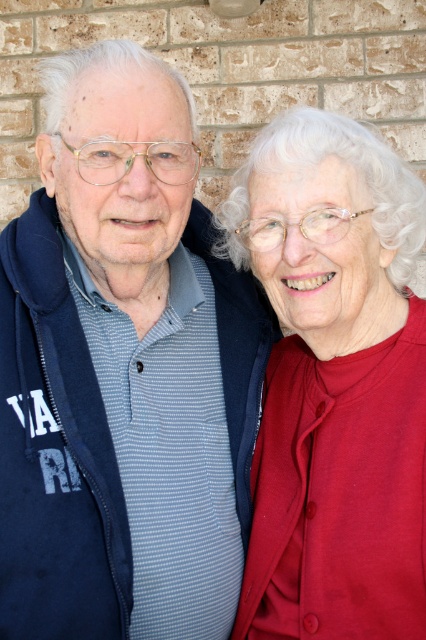
Question: Which point is farther to the camera?

Choices:
 (A) (106, 300)
 (B) (316, 481)

Answer: (A)

Question: Does blue striped shirt at center appear over matte red sweater at right?

Choices:
 (A) yes
 (B) no

Answer: (A)

Question: Can you confirm if blue striped shirt at center is positioned to the left of matte red sweater at right?

Choices:
 (A) no
 (B) yes

Answer: (B)

Question: Is blue striped shirt at center smaller than matte red sweater at right?

Choices:
 (A) no
 (B) yes

Answer: (A)